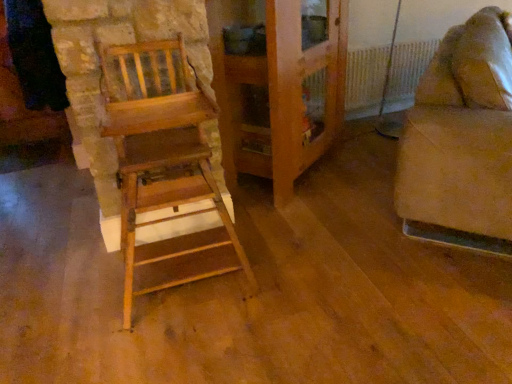
At what (x,y) coordinates should I click in order to perform the action: click on vacant space underneath wooden chair at left, marked as the 2th furniture in a right-to-left arrangement (from a real-world perspective). Please return your answer as a coordinate pair (x, y). Looking at the image, I should click on (192, 289).